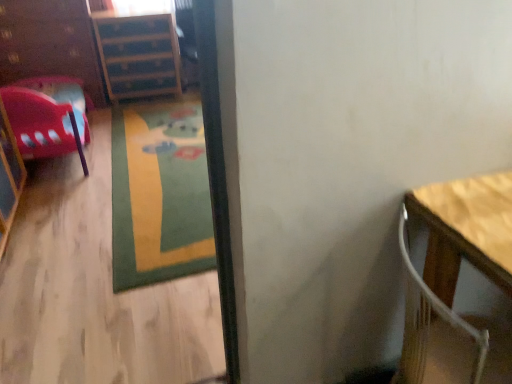
Question: Is wooden table at right at the back of wooden file cabinet at upper left?

Choices:
 (A) no
 (B) yes

Answer: (A)

Question: Does wooden file cabinet at upper left appear on the left side of wooden table at right?

Choices:
 (A) yes
 (B) no

Answer: (A)

Question: Is wooden table at right surrounded by wooden file cabinet at upper left?

Choices:
 (A) no
 (B) yes

Answer: (A)

Question: Is wooden file cabinet at upper left touching wooden table at right?

Choices:
 (A) yes
 (B) no

Answer: (B)

Question: Does wooden file cabinet at upper left have a larger size compared to wooden table at right?

Choices:
 (A) yes
 (B) no

Answer: (A)

Question: From a real-world perspective, is wooden file cabinet at upper left over wooden table at right?

Choices:
 (A) yes
 (B) no

Answer: (B)

Question: Does green carpet at center lie in front of wooden file cabinet at upper left?

Choices:
 (A) no
 (B) yes

Answer: (B)

Question: Can you confirm if green carpet at center is thinner than wooden file cabinet at upper left?

Choices:
 (A) no
 (B) yes

Answer: (A)

Question: Can we say green carpet at center lies outside wooden file cabinet at upper left?

Choices:
 (A) yes
 (B) no

Answer: (A)

Question: From the image's perspective, is green carpet at center on wooden file cabinet at upper left?

Choices:
 (A) yes
 (B) no

Answer: (B)

Question: Is green carpet at center oriented away from wooden file cabinet at upper left?

Choices:
 (A) yes
 (B) no

Answer: (A)

Question: Is green carpet at center bigger than wooden file cabinet at upper left?

Choices:
 (A) no
 (B) yes

Answer: (A)

Question: Would you say wooden file cabinet at upper left contains brushed wood dresser at left?

Choices:
 (A) no
 (B) yes

Answer: (A)